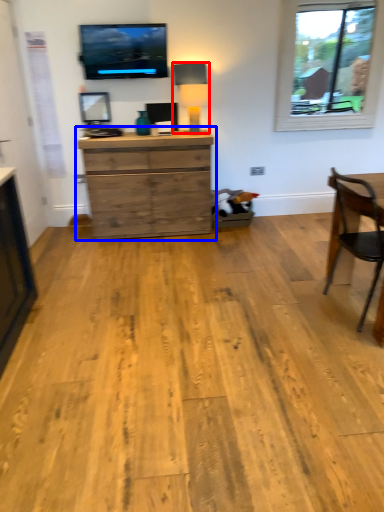
Question: Which object appears closest to the camera in this image, lamp (highlighted by a red box) or chest of drawers (highlighted by a blue box)?

Choices:
 (A) lamp
 (B) chest of drawers

Answer: (B)